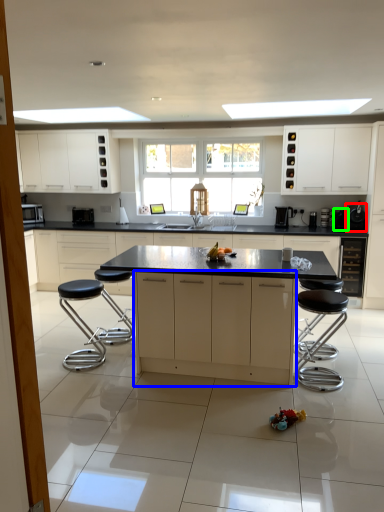
Question: Based on their relative distances, which object is farther from appliance (highlighted by a red box)? Choose from cabinetry (highlighted by a blue box) and appliance (highlighted by a green box).

Choices:
 (A) cabinetry
 (B) appliance

Answer: (A)